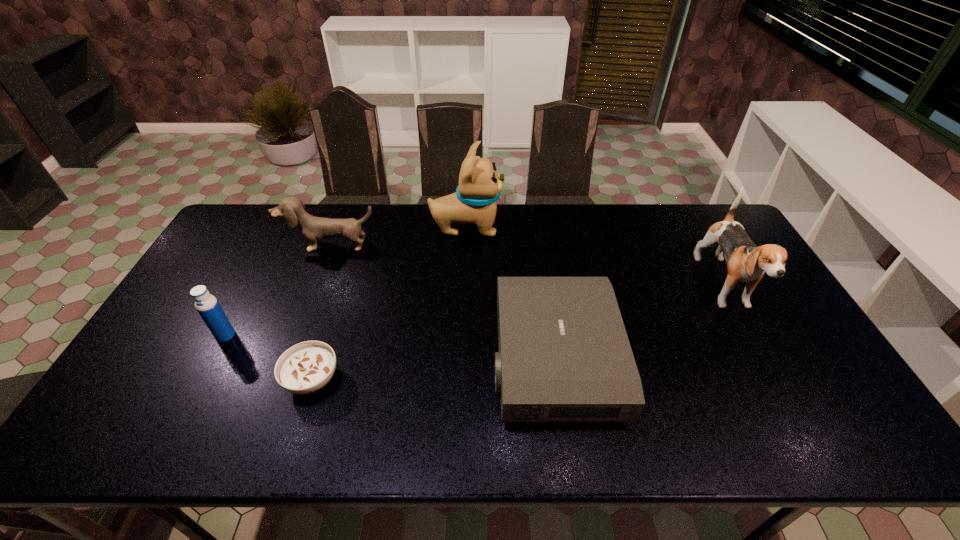
Point out which object is positioned as the third nearest to the soup bowl. Please provide its 2D coordinates. Your answer should be formatted as a tuple, i.e. [(x, y)], where the tuple contains the x and y coordinates of a point satisfying the conditions above.

[(314, 229)]

Locate which puppy is the second closest to the leftmost object. Please provide its 2D coordinates. Your answer should be formatted as a tuple, i.e. [(x, y)], where the tuple contains the x and y coordinates of a point satisfying the conditions above.

[(474, 201)]

Image resolution: width=960 pixels, height=540 pixels. Find the location of `the third closest puppy to the fifth tallest object`. the third closest puppy to the fifth tallest object is located at coordinates (314, 229).

At what (x,y) coordinates should I click in order to perform the action: click on free location that satisfies the following two spatial constraints: 1. on the face of the second puppy from right to left; 2. on the front side of the soup bowl. Please return your answer as a coordinate pair (x, y). The image size is (960, 540). Looking at the image, I should click on (460, 380).

Where is `free point that satisfies the following two spatial constraints: 1. on the face of the second puppy from right to left; 2. at the face of the shortest puppy`? free point that satisfies the following two spatial constraints: 1. on the face of the second puppy from right to left; 2. at the face of the shortest puppy is located at coordinates (466, 246).

Where is `vacant point that satisfies the following two spatial constraints: 1. at the face of the rightmost object; 2. on the front-facing side of the projector`? vacant point that satisfies the following two spatial constraints: 1. at the face of the rightmost object; 2. on the front-facing side of the projector is located at coordinates (764, 359).

You are a GUI agent. You are given a task and a screenshot of the screen. Output one action in this format:
    pyautogui.click(x=<x>, y=<y>)
    Task: Click on the free space that satisfies the following two spatial constraints: 1. on the face of the second puppy from left to right; 2. at the face of the leftmost puppy
    This screenshot has height=540, width=960.
    Given the screenshot: What is the action you would take?
    pyautogui.click(x=466, y=246)